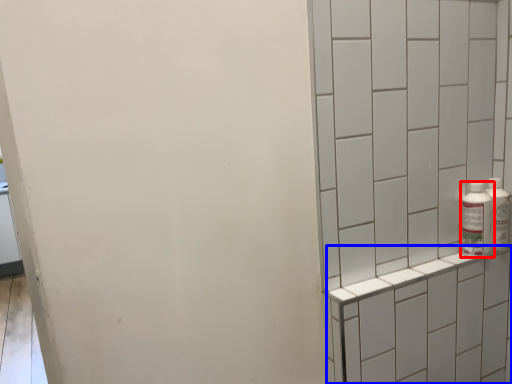
Question: Among these objects, which one is nearest to the camera, bottle (highlighted by a red box) or shelf (highlighted by a blue box)?

Choices:
 (A) bottle
 (B) shelf

Answer: (B)